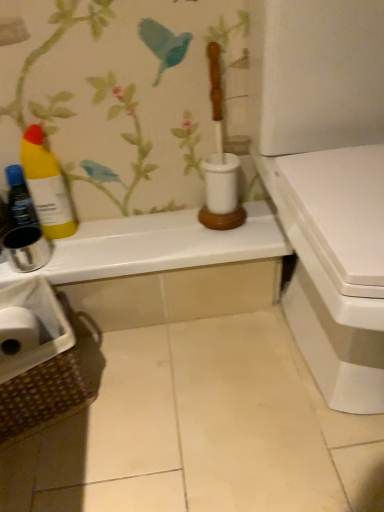
Question: Does brown woven laundry basket at lower left lie in front of yellow matte bottle at left, the 1th bottle viewed from the right?

Choices:
 (A) yes
 (B) no

Answer: (A)

Question: Does brown woven laundry basket at lower left lie behind yellow matte bottle at left, the 1th bottle viewed from the right?

Choices:
 (A) no
 (B) yes

Answer: (A)

Question: From a real-world perspective, is brown woven laundry basket at lower left physically above yellow matte bottle at left, the 1th bottle viewed from the right?

Choices:
 (A) no
 (B) yes

Answer: (A)

Question: Is brown woven laundry basket at lower left thinner than yellow matte bottle at left, which is the 2th bottle from left to right?

Choices:
 (A) no
 (B) yes

Answer: (A)

Question: Does brown woven laundry basket at lower left have a lesser height compared to yellow matte bottle at left, which is the 2th bottle from left to right?

Choices:
 (A) yes
 (B) no

Answer: (A)

Question: From the image's perspective, is brown woven laundry basket at lower left over yellow matte bottle at left, which is the 2th bottle from left to right?

Choices:
 (A) yes
 (B) no

Answer: (B)

Question: Can you confirm if white glossy counter top at upper center is smaller than yellow matte bottle at left, which is the 2th bottle from left to right?

Choices:
 (A) yes
 (B) no

Answer: (B)

Question: From the image's perspective, is white glossy counter top at upper center on top of yellow matte bottle at left, the 1th bottle viewed from the right?

Choices:
 (A) yes
 (B) no

Answer: (B)

Question: Can you confirm if white glossy counter top at upper center is thinner than yellow matte bottle at left, which is the 2th bottle from left to right?

Choices:
 (A) yes
 (B) no

Answer: (B)

Question: Does white glossy counter top at upper center appear on the left side of yellow matte bottle at left, the 1th bottle viewed from the right?

Choices:
 (A) yes
 (B) no

Answer: (B)

Question: From the image's perspective, is white glossy counter top at upper center located beneath yellow matte bottle at left, which is the 2th bottle from left to right?

Choices:
 (A) no
 (B) yes

Answer: (B)

Question: Is white glossy counter top at upper center positioned in front of yellow matte bottle at left, which is the 2th bottle from left to right?

Choices:
 (A) yes
 (B) no

Answer: (B)

Question: Is yellow matte bottle at left, which is the 2th bottle from left to right, closer to the viewer compared to brown woven laundry basket at lower left?

Choices:
 (A) no
 (B) yes

Answer: (A)